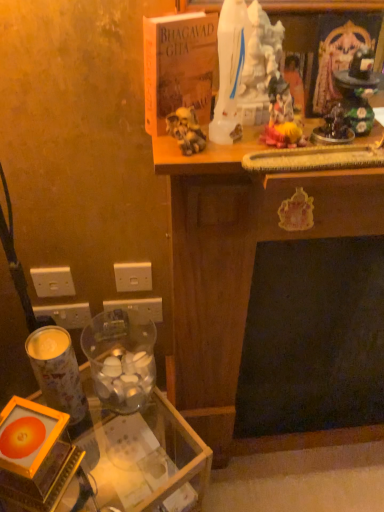
Question: Is white plastic electric outlet at lower left, the fourth electric outlet when ordered from right to left, wider or thinner than white plastic electric outlet at lower left, acting as the fourth electric outlet starting from the left?

Choices:
 (A) wide
 (B) thin

Answer: (A)

Question: From a real-world perspective, relative to white plastic electric outlet at lower left, which appears as the first electric outlet when viewed from the right, is white plastic electric outlet at lower left, placed as the 1th electric outlet when sorted from left to right, vertically above or below?

Choices:
 (A) above
 (B) below

Answer: (B)

Question: Based on their relative distances, which object is nearer to the white plastic electric outlet at lower left, acting as the fourth electric outlet starting from the left?

Choices:
 (A) white plastic electric outlet at lower left, the 3th electric outlet viewed from the right
 (B) transparent glass candle holder at lower left, the first candle holder from the right
 (C) white plastic electric outlet at lower left, the fourth electric outlet when ordered from right to left
 (D) metallic cylindrical candle holder at lower left, the second candle holder in the right-to-left sequence
 (E) transparent glass table at lower left

Answer: (A)

Question: Estimate the real-world distances between objects in this image. Which object is closer to the white plastic electric outlet at lower left, which appears as the first electric outlet when viewed from the right?

Choices:
 (A) transparent glass candle holder at lower left, arranged as the second candle holder when viewed from the left
 (B) transparent glass table at lower left
 (C) hardcover bhagavad gita at upper center
 (D) white plastic electric outlet at lower left, arranged as the 3th electric outlet when viewed from the left
 (E) white plastic electric outlet at lower left, the 2th electric outlet from the left

Answer: (D)